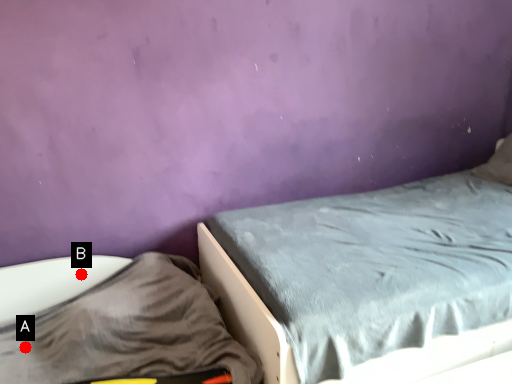
Question: Two points are circled on the image, labeled by A and B beside each circle. Among these points, which one is farthest from the camera?

Choices:
 (A) A is further
 (B) B is further

Answer: (B)